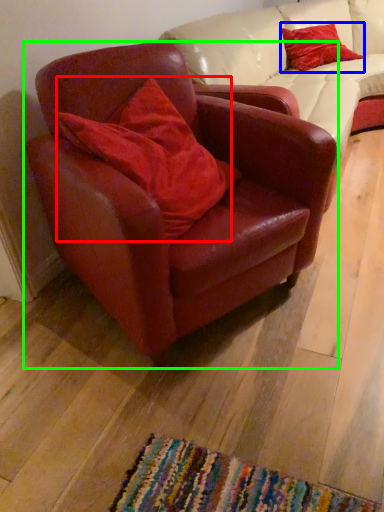
Question: Which object is the farthest from pillow (highlighted by a red box)? Choose among these: pillow (highlighted by a blue box) or chair (highlighted by a green box).

Choices:
 (A) pillow
 (B) chair

Answer: (A)